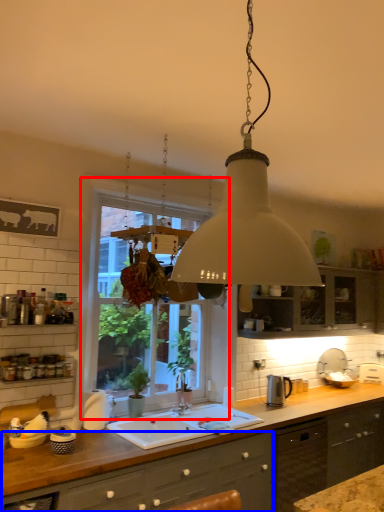
Question: Which object appears closest to the camera in this image, window (highlighted by a red box) or cabinetry (highlighted by a blue box)?

Choices:
 (A) window
 (B) cabinetry

Answer: (B)